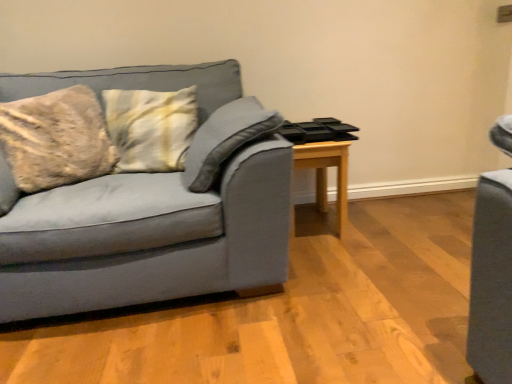
Question: Should I look upward or downward to see matte gray couch at left?

Choices:
 (A) up
 (B) down

Answer: (A)

Question: Is light wood table at center to the right of matte gray couch at left from the viewer's perspective?

Choices:
 (A) no
 (B) yes

Answer: (B)

Question: Is there a large distance between light wood table at center and matte gray couch at left?

Choices:
 (A) yes
 (B) no

Answer: (B)

Question: From the image's perspective, is light wood table at center on matte gray couch at left?

Choices:
 (A) no
 (B) yes

Answer: (A)

Question: Can you confirm if light wood table at center is bigger than matte gray couch at left?

Choices:
 (A) yes
 (B) no

Answer: (B)

Question: From a real-world perspective, is light wood table at center beneath matte gray couch at left?

Choices:
 (A) no
 (B) yes

Answer: (B)

Question: Does light wood table at center turn towards matte gray couch at left?

Choices:
 (A) no
 (B) yes

Answer: (A)

Question: From the image's perspective, would you say matte gray couch at left is shown under light wood table at center?

Choices:
 (A) no
 (B) yes

Answer: (A)

Question: Is matte gray couch at left surrounding light wood table at center?

Choices:
 (A) yes
 (B) no

Answer: (B)

Question: Is matte gray couch at left to the left of light wood table at center from the viewer's perspective?

Choices:
 (A) no
 (B) yes

Answer: (B)

Question: Is matte gray couch at left further to the viewer compared to light wood table at center?

Choices:
 (A) yes
 (B) no

Answer: (B)

Question: Considering the relative sizes of matte gray couch at left and light wood table at center in the image provided, is matte gray couch at left wider than light wood table at center?

Choices:
 (A) no
 (B) yes

Answer: (B)

Question: From a real-world perspective, is matte gray couch at left positioned over light wood table at center based on gravity?

Choices:
 (A) no
 (B) yes

Answer: (B)

Question: From a real-world perspective, is light wood table at center physically located above or below matte gray couch at left?

Choices:
 (A) below
 (B) above

Answer: (A)